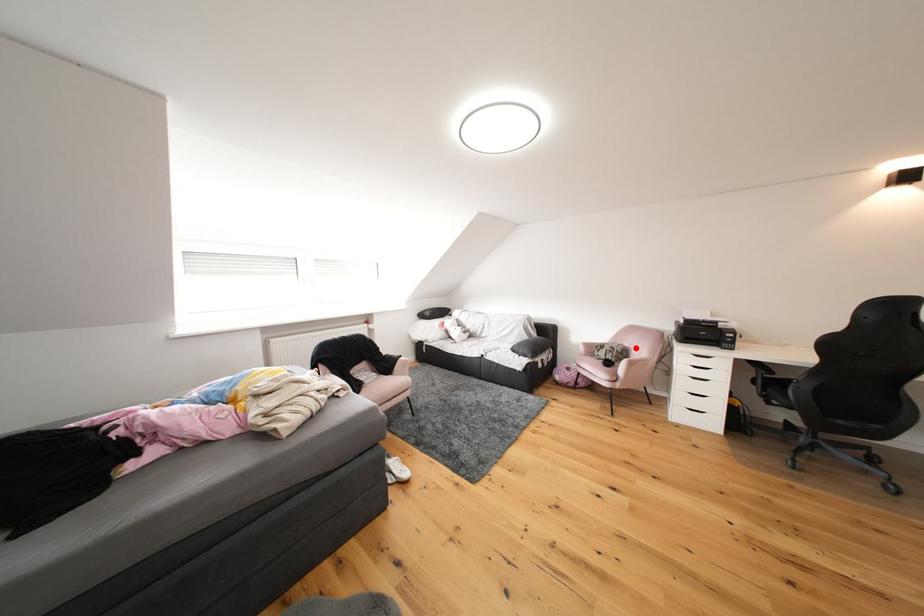
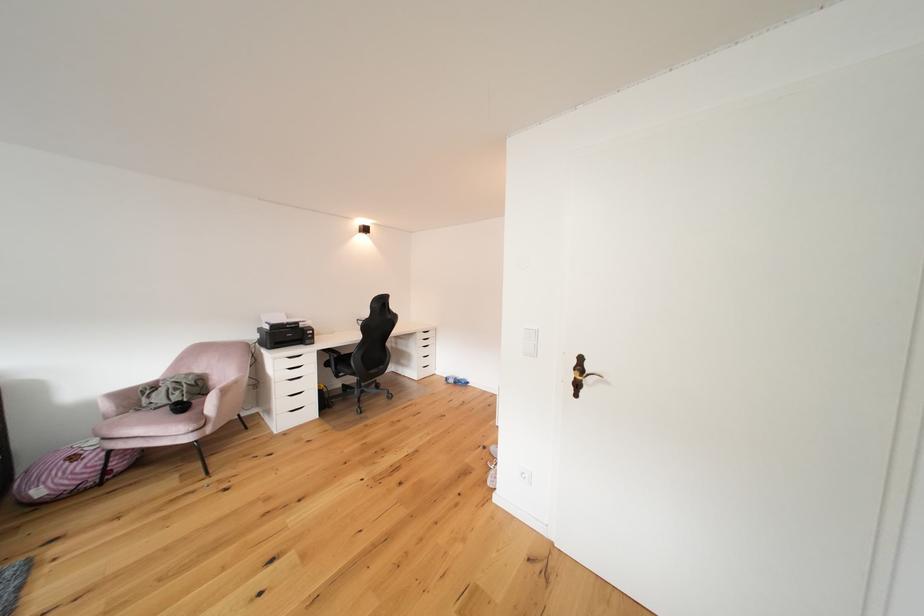
Find the pixel in the second image that matches the highlighted location in the first image.

(208, 374)